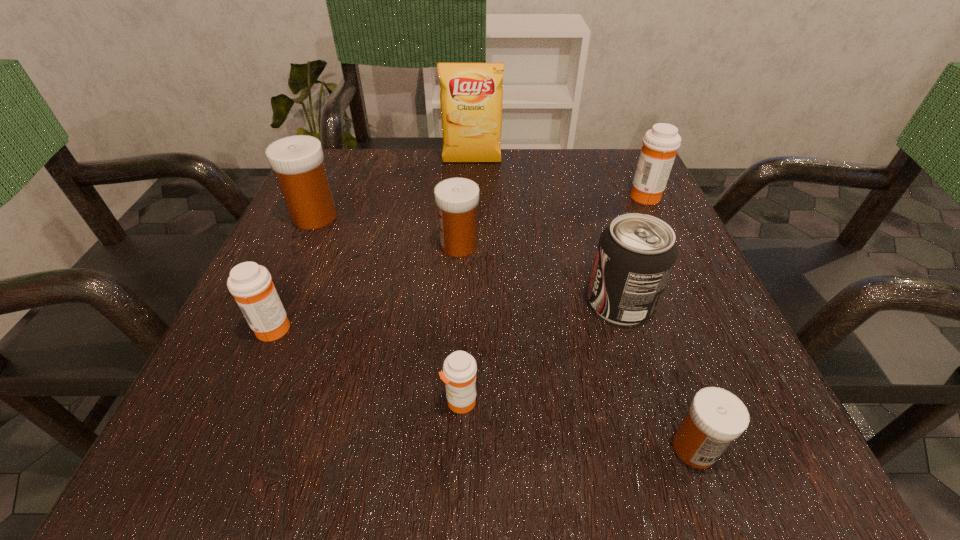
Image resolution: width=960 pixels, height=540 pixels. Find the location of `orange medicine that stands as the closest to the leftmost white medicine`. orange medicine that stands as the closest to the leftmost white medicine is located at coordinates (251, 284).

Where is `white medicine that is the closest one to the biggest white medicine`? The image size is (960, 540). white medicine that is the closest one to the biggest white medicine is located at coordinates (457, 199).

Locate an element on the screen. The width and height of the screenshot is (960, 540). white medicine that can be found as the second closest to the seventh farthest object is located at coordinates (457, 199).

The width and height of the screenshot is (960, 540). I want to click on free point that satisfies the following two spatial constraints: 1. on the front of the farthest orange medicine with the logo; 2. on the right side of the crisp (potato chip), so click(471, 195).

Locate an element on the screen. free spot that satisfies the following two spatial constraints: 1. on the back side of the rightmost orange medicine; 2. on the left side of the second nearest orange medicine is located at coordinates (330, 195).